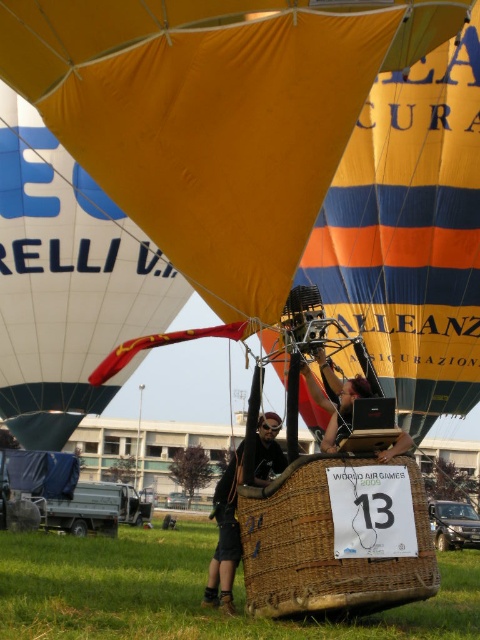
You are standing at the origin point in the image. Which direction should you move to reach the yellow fabric hot air balloon at center?

The yellow fabric hot air balloon at center is located at coordinates 0.181 on the x axis and 0.450 on the y axis. Since you are at the origin point, you should move to the right along the x axis and upwards along the y axis to reach it.

You are standing at the point labeled point [76,35] and want to move towards the point labeled point [49,282]. Given that the distance between these two points is 0.387 units, will you move forward or backward to reach the destination?

Since point [76,35] is closer to the camera than point [49,282], moving towards point [49,282] would require moving backward. Therefore, you should move backward to reach the destination.